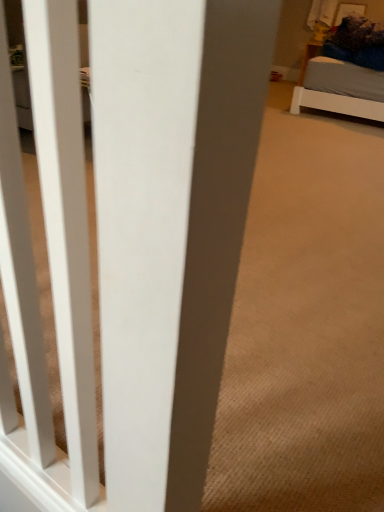
The width and height of the screenshot is (384, 512). Describe the element at coordinates (171, 225) in the screenshot. I see `white matte door at left` at that location.

Measure the distance between point (170,8) and camera.

Point (170,8) is 23.50 centimeters from camera.

You are a GUI agent. You are given a task and a screenshot of the screen. Output one action in this format:
    pyautogui.click(x=<x>, y=<y>)
    Task: Click on the white matte door at left
    The image size is (384, 512).
    Given the screenshot: What is the action you would take?
    pyautogui.click(x=171, y=225)

I want to click on white matte door at left, so click(x=171, y=225).